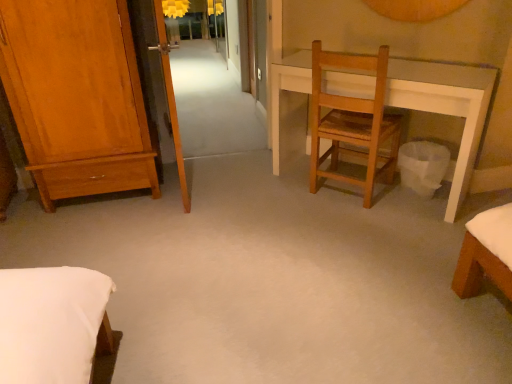
At what (x,y) coordinates should I click in order to perform the action: click on free region on the left part of white paper trash can at lower right. Please return your answer as a coordinate pair (x, y). Looking at the image, I should click on (373, 202).